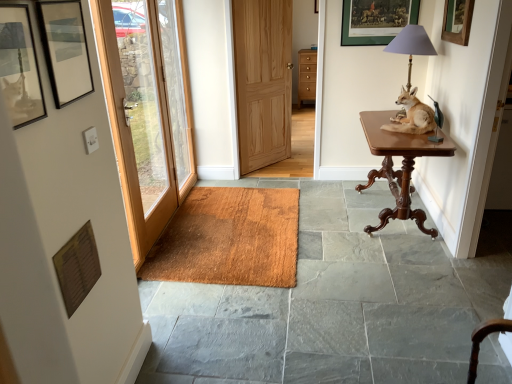
Question: Is natural wood door at center, placed as the 1th door when sorted from right to left, oriented towards wooden picture frame at upper center, which is the fourth picture frame in front-to-back order?

Choices:
 (A) yes
 (B) no

Answer: (A)

Question: Is the position of natural wood door at center, the second door when ordered from left to right, more distant than that of wooden picture frame at upper center, which is the fourth picture frame from bottom to top?

Choices:
 (A) no
 (B) yes

Answer: (B)

Question: Considering the relative sizes of natural wood door at center, the second door when ordered from left to right, and wooden picture frame at upper center, which is the fourth picture frame in front-to-back order, in the image provided, is natural wood door at center, the second door when ordered from left to right, bigger than wooden picture frame at upper center, which is the fourth picture frame in front-to-back order,?

Choices:
 (A) no
 (B) yes

Answer: (B)

Question: Is natural wood door at center, positioned as the second door in front-to-back order, to the left of wooden picture frame at upper center, which is the fourth picture frame from bottom to top, from the viewer's perspective?

Choices:
 (A) no
 (B) yes

Answer: (B)

Question: Is natural wood door at center, placed as the first door when sorted from back to front, to the right of wooden picture frame at upper center, which is counted as the first picture frame, starting from the back, from the viewer's perspective?

Choices:
 (A) yes
 (B) no

Answer: (B)

Question: From a real-world perspective, relative to wooden picture frame at upper right, which is the 2th picture frame in back-to-front order, is clear glass door at left vertically above or below?

Choices:
 (A) above
 (B) below

Answer: (B)

Question: Is point coord(176,34) positioned closer to the camera than point coord(456,3)?

Choices:
 (A) closer
 (B) farther

Answer: (B)

Question: Considering the positions of clear glass door at left and wooden picture frame at upper right, placed as the fourth picture frame when sorted from left to right, in the image, is clear glass door at left bigger or smaller than wooden picture frame at upper right, placed as the fourth picture frame when sorted from left to right,?

Choices:
 (A) big
 (B) small

Answer: (A)

Question: Considering the positions of clear glass door at left and wooden picture frame at upper right, the 2th picture frame viewed from the top, in the image, is clear glass door at left taller or shorter than wooden picture frame at upper right, the 2th picture frame viewed from the top,?

Choices:
 (A) tall
 (B) short

Answer: (A)

Question: From the image's perspective, is wooden door at left, which is counted as the 2th door, starting from the right, above or below mahogany wood table at right?

Choices:
 (A) above
 (B) below

Answer: (A)

Question: Relative to mahogany wood table at right, is wooden door at left, which is counted as the 2th door, starting from the right, in front or behind?

Choices:
 (A) behind
 (B) front

Answer: (B)

Question: Is wooden door at left, which is counted as the 2th door, starting from the right, bigger or smaller than mahogany wood table at right?

Choices:
 (A) small
 (B) big

Answer: (A)

Question: From a real-world perspective, is wooden door at left, which is the first door in front-to-back order, positioned above or below mahogany wood table at right?

Choices:
 (A) above
 (B) below

Answer: (A)

Question: Is clear glass door at left situated inside mahogany wood table at right or outside?

Choices:
 (A) inside
 (B) outside

Answer: (B)

Question: In terms of size, does clear glass door at left appear bigger or smaller than mahogany wood table at right?

Choices:
 (A) big
 (B) small

Answer: (B)